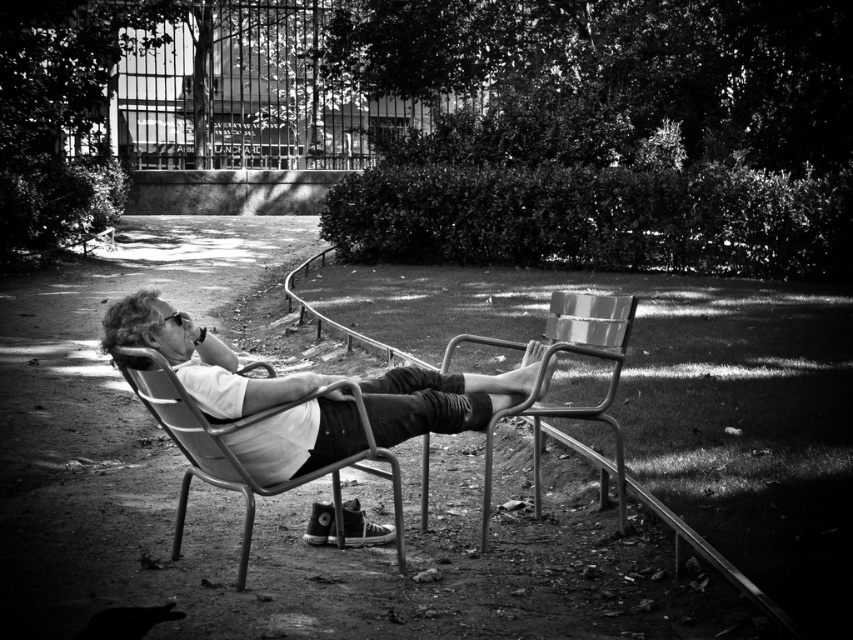
Is point (143, 323) closer to viewer compared to point (120, 368)?

Yes, it is.

Between point (289, 449) and point (160, 381), which one is positioned behind?

The point (289, 449) is behind.

Find the location of a particular element. metallic silver chair at center is located at coordinates (196, 358).

Find the location of a particular element. This screenshot has height=640, width=853. metallic silver chair at center is located at coordinates (196, 358).

Which is in front, point (363, 445) or point (425, 477)?

Point (363, 445) is more forward.

Can you confirm if metallic silver chair at center is positioned above metallic silver beach chair at center?

Yes.

Between point (234, 408) and point (567, 328), which one is positioned behind?

The point (567, 328) is more distant.

Locate an element on the screen. The image size is (853, 640). metallic silver chair at center is located at coordinates (196, 358).

Find the location of a particular element. metallic frame chair at center is located at coordinates (236, 452).

Which is behind, point (360, 422) or point (599, 410)?

Positioned behind is point (599, 410).

Where is `metallic frame chair at center`? The height and width of the screenshot is (640, 853). metallic frame chair at center is located at coordinates (236, 452).